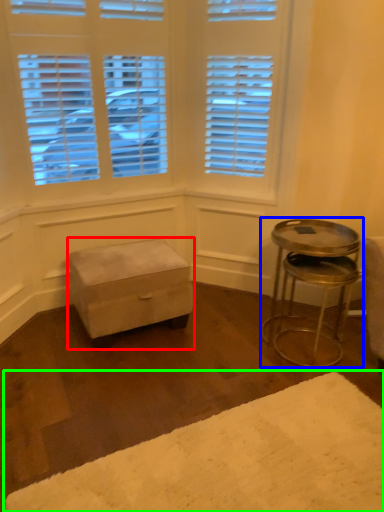
Question: Based on their relative distances, which object is nearer to stool (highlighted by a red box)? Choose from table (highlighted by a blue box) and plain (highlighted by a green box).

Choices:
 (A) table
 (B) plain

Answer: (A)